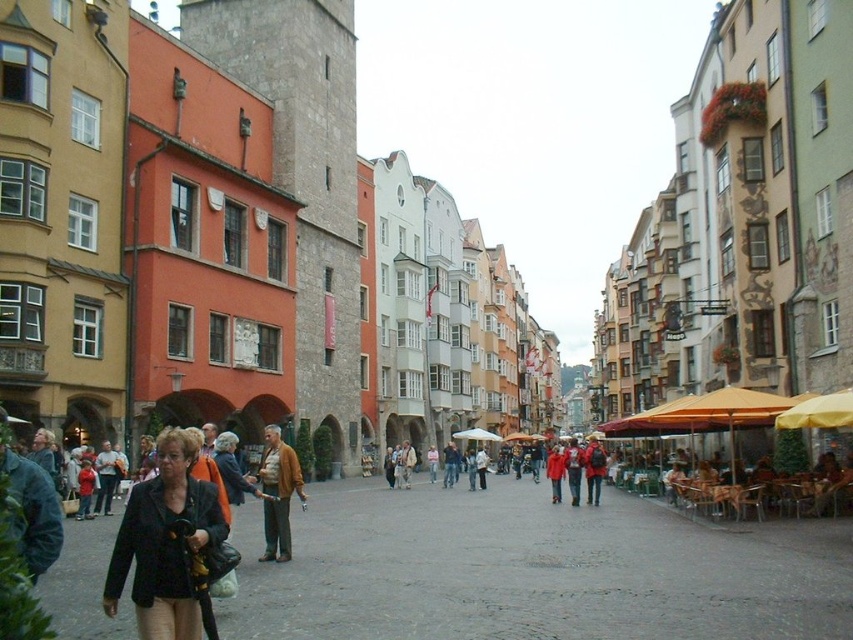
Question: Estimate the real-world distances between objects in this image. Which object is farther from the red backpack at center?

Choices:
 (A) black fabric jacket at lower left
 (B) brown leather jacket at lower left

Answer: (A)

Question: Among these points, which one is nearest to the camera?

Choices:
 (A) (199, 593)
 (B) (590, 481)
 (C) (277, 536)

Answer: (A)

Question: Considering the real-world distances, which object is closest to the red backpack at center?

Choices:
 (A) brown leather jacket at lower left
 (B) black fabric jacket at lower left

Answer: (A)

Question: Where is black fabric jacket at lower left located in relation to brown leather jacket at lower left in the image?

Choices:
 (A) above
 (B) below

Answer: (A)

Question: Does brown leather jacket at lower left have a lesser width compared to red backpack at center?

Choices:
 (A) yes
 (B) no

Answer: (A)

Question: Does black fabric jacket at lower left have a lesser width compared to brown leather jacket at lower left?

Choices:
 (A) no
 (B) yes

Answer: (A)